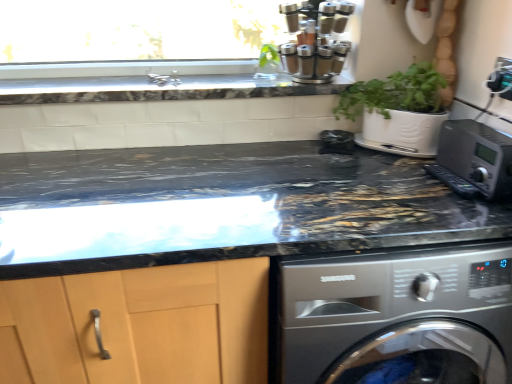
Where is `free space in front of metallic silver microwave at right`? The width and height of the screenshot is (512, 384). free space in front of metallic silver microwave at right is located at coordinates (472, 215).